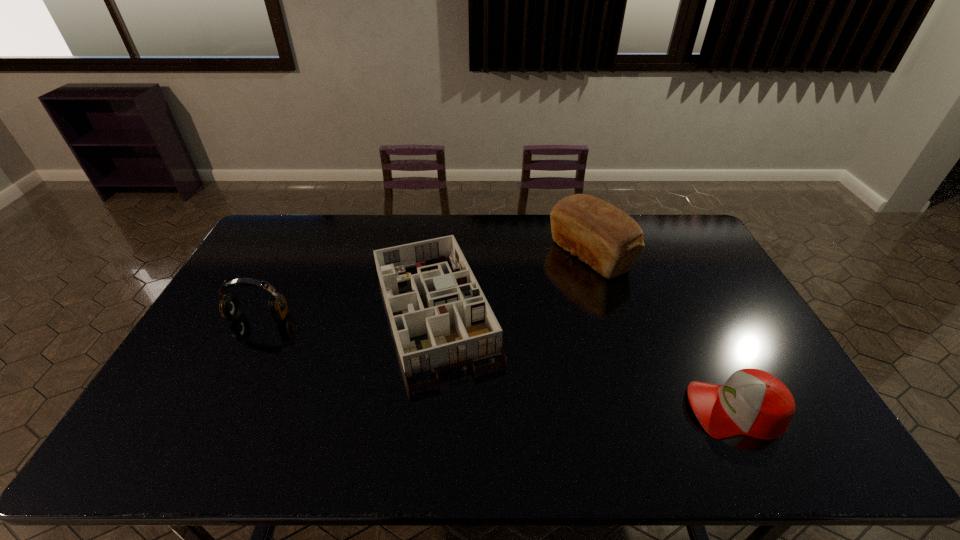
At what (x,y) coordinates should I click in order to perform the action: click on free space located on the right of the dollhouse. Please return your answer as a coordinate pair (x, y). This screenshot has width=960, height=540. Looking at the image, I should click on (542, 314).

Where is `object that is at the far edge`? This screenshot has width=960, height=540. object that is at the far edge is located at coordinates (601, 235).

I want to click on object at the near edge, so click(752, 402).

Identify the location of object that is at the left edge. The image size is (960, 540). (230, 308).

Find the location of a particular element. object that is at the right edge is located at coordinates click(752, 402).

Locate an element on the screen. This screenshot has height=540, width=960. object that is at the near right corner is located at coordinates (752, 402).

This screenshot has width=960, height=540. In the image, there is a desktop. Identify the location of free space at the far edge. (371, 242).

Locate an element on the screen. Image resolution: width=960 pixels, height=540 pixels. free space at the near edge of the desktop is located at coordinates (337, 457).

Image resolution: width=960 pixels, height=540 pixels. What are the coordinates of `vacant space at the left edge` in the screenshot? It's located at tap(257, 267).

The width and height of the screenshot is (960, 540). I want to click on free spot at the right edge of the desktop, so click(x=708, y=310).